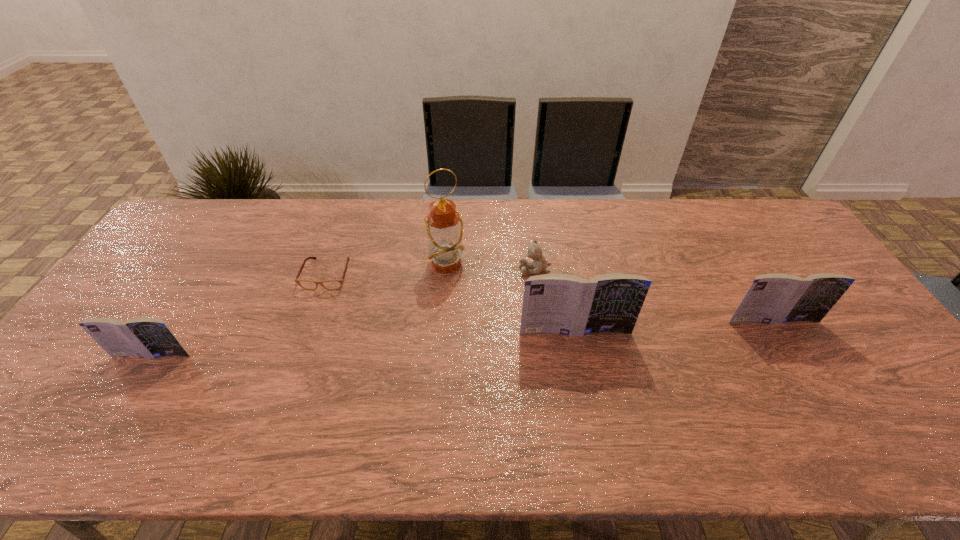
Where is `the leftmost object`? The width and height of the screenshot is (960, 540). the leftmost object is located at coordinates click(148, 337).

Where is `the nearest book`? This screenshot has width=960, height=540. the nearest book is located at coordinates (148, 337).

You are a GUI agent. You are given a task and a screenshot of the screen. Output one action in this format:
    pyautogui.click(x=<x>, y=<y>)
    Task: Click on the second nearest book
    This screenshot has width=960, height=540.
    Given the screenshot: What is the action you would take?
    pyautogui.click(x=565, y=304)

Where is `the fifth shortest object`? Image resolution: width=960 pixels, height=540 pixels. the fifth shortest object is located at coordinates (565, 304).

The width and height of the screenshot is (960, 540). Identify the location of the second shortest book. (774, 298).

This screenshot has width=960, height=540. Find the location of `the rightmost object`. the rightmost object is located at coordinates (774, 298).

Find the location of a particular element. the fourth object from right to left is located at coordinates (444, 225).

Where is `the tallest object`? the tallest object is located at coordinates (444, 225).

I want to click on the second object from left to right, so click(336, 284).

Find the location of a particular element. This screenshot has height=540, width=960. spectacles is located at coordinates (336, 284).